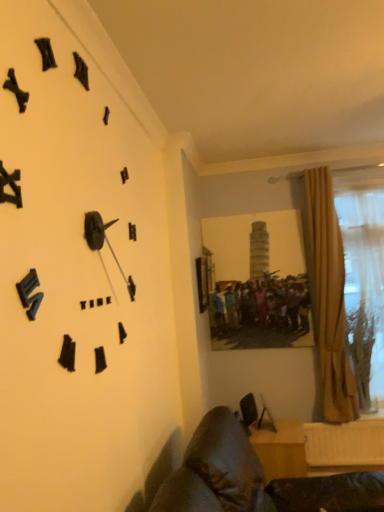
Image resolution: width=384 pixels, height=512 pixels. What do you see at coordinates (281, 449) in the screenshot?
I see `wooden desk at lower right, placed as the 2th furniture when sorted from front to back` at bounding box center [281, 449].

At what (x,y) coordinates should I click in order to perform the action: click on beige fabric curtain at right. Please return your answer as a coordinate pair (x, y). Image resolution: width=384 pixels, height=512 pixels. Looking at the image, I should click on (327, 298).

Choose the correct answer: Is leather couch at lower left, which is the second furniture in back-to-front order, inside black matte clock at upper left or outside it?

The correct answer is: outside.

From the image's perspective, does leather couch at lower left, which is the second furniture in back-to-front order, appear lower than black matte clock at upper left?

Indeed, from the image's perspective, leather couch at lower left, which is the second furniture in back-to-front order, is shown beneath black matte clock at upper left.

From a real-world perspective, between leather couch at lower left, which is the second furniture in back-to-front order, and black matte clock at upper left, who is vertically higher?

black matte clock at upper left is physically above.

Is leather couch at lower left, which is the first furniture from front to back, touching black matte clock at upper left?

leather couch at lower left, which is the first furniture from front to back, is not next to black matte clock at upper left, and they're not touching.

Is beige fabric curtain at right facing towards leather couch at lower left, which is the second furniture in back-to-front order?

No.

At what (x,y) coordinates should I click in order to perform the action: click on the 1st furniture below the beige fabric curtain at right (from the image's perspective). Please return your answer as a coordinate pair (x, y). This screenshot has width=384, height=512. Looking at the image, I should click on (255, 479).

Can you confirm if beige fabric curtain at right is positioned to the right of leather couch at lower left, which is the second furniture in back-to-front order?

Yes, beige fabric curtain at right is to the right of leather couch at lower left, which is the second furniture in back-to-front order.

Which of these two, beige fabric curtain at right or leather couch at lower left, which is the second furniture in back-to-front order, stands taller?

beige fabric curtain at right.

Is point (282, 429) closer to camera compared to point (208, 450)?

No.

From a real-world perspective, who is located higher, wooden desk at lower right, placed as the 2th furniture when sorted from front to back, or leather couch at lower left, which is the first furniture from front to back?

leather couch at lower left, which is the first furniture from front to back.

From the image's perspective, which is above, wooden desk at lower right, arranged as the 1th furniture when viewed from the back, or leather couch at lower left, which is the first furniture from front to back?

leather couch at lower left, which is the first furniture from front to back, from the image's perspective.

Find the location of a particular element. The width and height of the screenshot is (384, 512). furniture that is in front of the wooden desk at lower right, placed as the 2th furniture when sorted from front to back is located at coordinates (255, 479).

Which is behind, point (327, 172) or point (290, 442)?

The point (327, 172) is behind.

Who is more distant, beige fabric curtain at right or wooden desk at lower right, arranged as the 1th furniture when viewed from the back?

beige fabric curtain at right is further from the camera.

I want to click on curtain above the wooden desk at lower right, arranged as the 1th furniture when viewed from the back (from a real-world perspective), so click(327, 298).

Is black matte clock at upper left directly adjacent to wooden desk at lower right, arranged as the 1th furniture when viewed from the back?

black matte clock at upper left and wooden desk at lower right, arranged as the 1th furniture when viewed from the back, are not in contact.

From the image's perspective, is black matte clock at upper left above wooden desk at lower right, arranged as the 1th furniture when viewed from the back?

Correct, black matte clock at upper left appears higher than wooden desk at lower right, arranged as the 1th furniture when viewed from the back, in the image.

Could wooden desk at lower right, arranged as the 1th furniture when viewed from the back, be considered to be inside black matte clock at upper left?

→ No, wooden desk at lower right, arranged as the 1th furniture when viewed from the back, is not surrounded by black matte clock at upper left.

Does black matte clock at upper left turn towards wooden desk at lower right, arranged as the 1th furniture when viewed from the back?

No, black matte clock at upper left does not turn towards wooden desk at lower right, arranged as the 1th furniture when viewed from the back.

How many degrees apart are the facing directions of beige fabric curtain at right and black matte clock at upper left?

The angular difference between beige fabric curtain at right and black matte clock at upper left is 88.3 degrees.

Which object is closer to the camera, beige fabric curtain at right or black matte clock at upper left?

black matte clock at upper left is closer to the camera.

Is beige fabric curtain at right to the right of black matte clock at upper left from the viewer's perspective?

Yes.

Which object is thinner, beige fabric curtain at right or black matte clock at upper left?

Thinner between the two is black matte clock at upper left.

From the image's perspective, between translucent fabric curtain at right and leather couch at lower left, which is the first furniture from front to back, who is located below?

leather couch at lower left, which is the first furniture from front to back, from the image's perspective.

In terms of height, does translucent fabric curtain at right look taller or shorter compared to leather couch at lower left, which is the first furniture from front to back?

Considering their sizes, translucent fabric curtain at right has more height than leather couch at lower left, which is the first furniture from front to back.

How distant is translucent fabric curtain at right from leather couch at lower left, which is the first furniture from front to back?

They are 5.05 feet apart.

Where is `bay window above the leather couch at lower left, which is the first furniture from front to back (from the image's perspective)`? Image resolution: width=384 pixels, height=512 pixels. bay window above the leather couch at lower left, which is the first furniture from front to back (from the image's perspective) is located at coordinates (364, 288).

Find the location of a particular element. the 1st furniture behind when counting from the black matte clock at upper left is located at coordinates [255, 479].

At what (x,y) coordinates should I click in order to perform the action: click on the 2nd furniture to the left when counting from the beige fabric curtain at right. Please return your answer as a coordinate pair (x, y). The image size is (384, 512). Looking at the image, I should click on (255, 479).

Which object lies further to the anchor point black matte clock at upper left, translucent fabric curtain at right or beige fabric curtain at right?

translucent fabric curtain at right is positioned further to the anchor black matte clock at upper left.

Which object lies nearer to the anchor point beige fabric curtain at right, leather couch at lower left, which is the second furniture in back-to-front order, or wooden desk at lower right, placed as the 2th furniture when sorted from front to back?

Among the two, wooden desk at lower right, placed as the 2th furniture when sorted from front to back, is located nearer to beige fabric curtain at right.

Considering their positions, is translucent fabric curtain at right positioned further to wooden desk at lower right, placed as the 2th furniture when sorted from front to back, than beige fabric curtain at right?

translucent fabric curtain at right is positioned further to the anchor wooden desk at lower right, placed as the 2th furniture when sorted from front to back.

When comparing their distances from black matte clock at upper left, does wooden desk at lower right, arranged as the 1th furniture when viewed from the back, or translucent fabric curtain at right seem closer?

Based on the image, wooden desk at lower right, arranged as the 1th furniture when viewed from the back, appears to be nearer to black matte clock at upper left.

When comparing their distances from beige fabric curtain at right, does translucent fabric curtain at right or wooden desk at lower right, placed as the 2th furniture when sorted from front to back, seem closer?

Based on the image, translucent fabric curtain at right appears to be nearer to beige fabric curtain at right.

Which object lies further to the anchor point leather couch at lower left, which is the first furniture from front to back, beige fabric curtain at right or black matte clock at upper left?

beige fabric curtain at right.

Which object lies nearer to the anchor point leather couch at lower left, which is the second furniture in back-to-front order, beige fabric curtain at right or wooden desk at lower right, placed as the 2th furniture when sorted from front to back?

Based on the image, wooden desk at lower right, placed as the 2th furniture when sorted from front to back, appears to be nearer to leather couch at lower left, which is the second furniture in back-to-front order.

Estimate the real-world distances between objects in this image. Which object is further from black matte clock at upper left, leather couch at lower left, which is the second furniture in back-to-front order, or wooden desk at lower right, placed as the 2th furniture when sorted from front to back?

Based on the image, wooden desk at lower right, placed as the 2th furniture when sorted from front to back, appears to be further to black matte clock at upper left.

This screenshot has height=512, width=384. In order to click on curtain between black matte clock at upper left and translucent fabric curtain at right from front to back in this screenshot , I will do `click(327, 298)`.

Where is `furniture located between leather couch at lower left, which is the first furniture from front to back, and beige fabric curtain at right in the depth direction`? furniture located between leather couch at lower left, which is the first furniture from front to back, and beige fabric curtain at right in the depth direction is located at coordinates (281, 449).

At what (x,y) coordinates should I click in order to perform the action: click on furniture positioned between leather couch at lower left, which is the first furniture from front to back, and translucent fabric curtain at right from near to far. Please return your answer as a coordinate pair (x, y). Looking at the image, I should click on (281, 449).

The width and height of the screenshot is (384, 512). Identify the location of curtain between translucent fabric curtain at right and wooden desk at lower right, arranged as the 1th furniture when viewed from the back, from top to bottom. (327, 298).